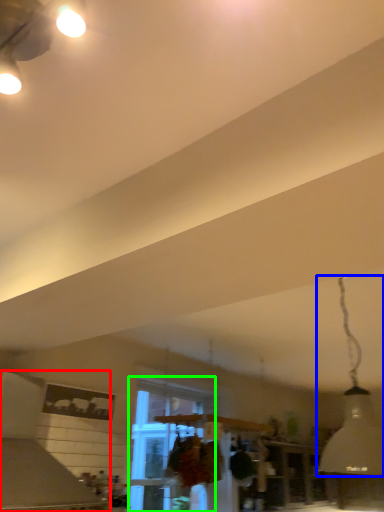
Question: Which object is positioned closest to vent (highlighted by a red box)? Select from lamp (highlighted by a blue box) and window (highlighted by a green box).

Choices:
 (A) lamp
 (B) window

Answer: (B)